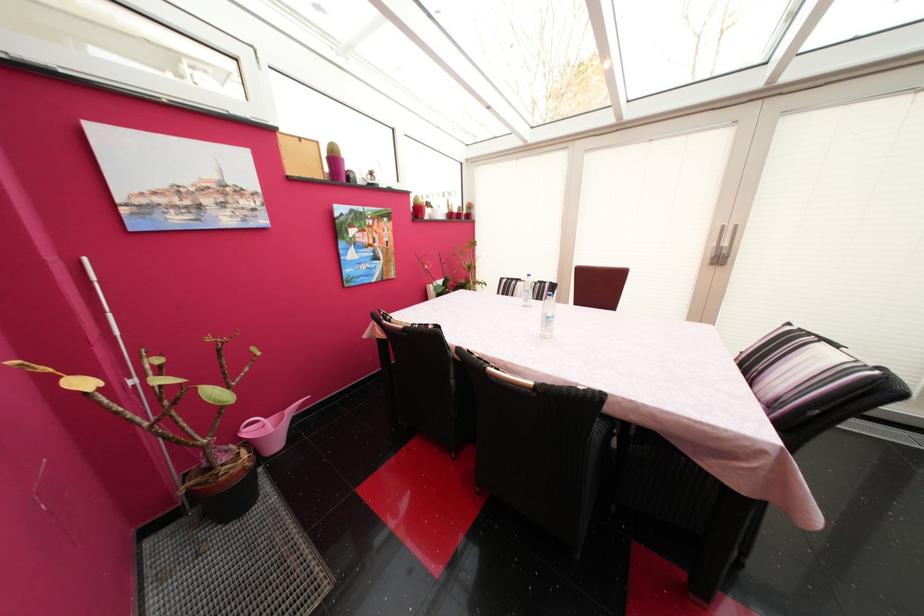
Find the location of a particular element. silver door handle is located at coordinates (723, 245).